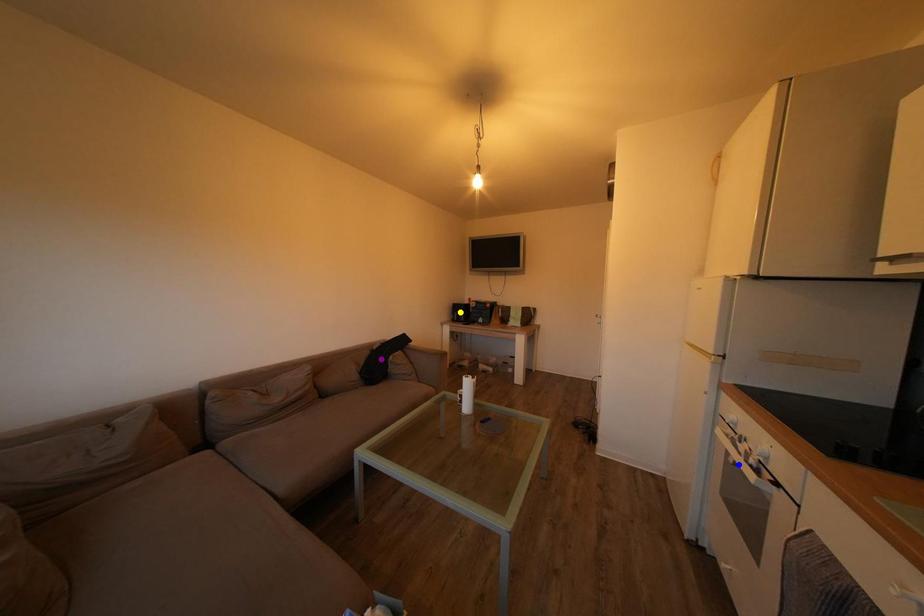
Order these from nearest to farthest:
1. purple point
2. yellow point
3. blue point

blue point
purple point
yellow point